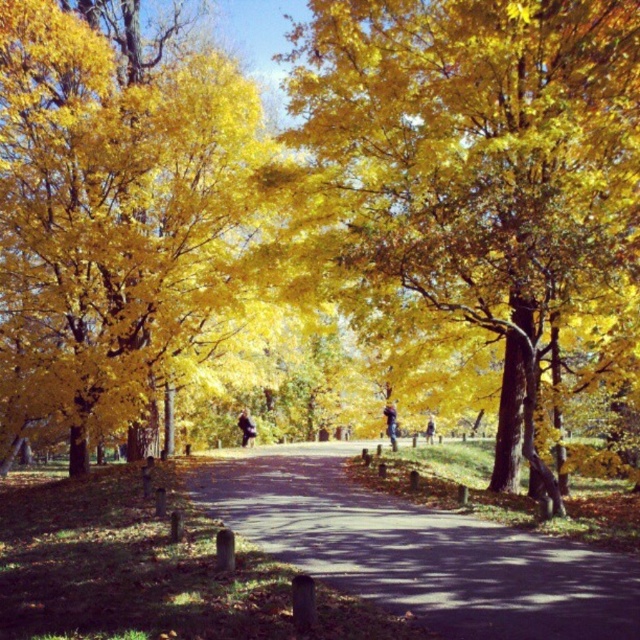
Does golden yellow leaves at upper left have a lesser height compared to dark blue jeans at center?

Incorrect, golden yellow leaves at upper left's height does not fall short of dark blue jeans at center's.

Who is lower down, golden yellow leaves at upper left or dark blue jeans at center?

dark blue jeans at center

In order to click on golden yellow leaves at upper left in this screenshot , I will do `click(113, 220)`.

I want to click on golden yellow leaves at upper left, so click(113, 220).

The height and width of the screenshot is (640, 640). Describe the element at coordinates (417, 550) in the screenshot. I see `dark asphalt path at center` at that location.

Which of these two, dark asphalt path at center or dark blue jeans at center, stands shorter?

dark asphalt path at center

Between point (499, 580) and point (241, 416), which one is positioned behind?

The point (241, 416) is behind.

The height and width of the screenshot is (640, 640). Identify the location of dark asphalt path at center. (417, 550).

Does point (232, 298) come behind point (394, 404)?

No.

Who is more distant from viewer, (253, 145) or (394, 445)?

The point (394, 445) is more distant.

Identify the location of golden yellow leaves at upper left. (113, 220).